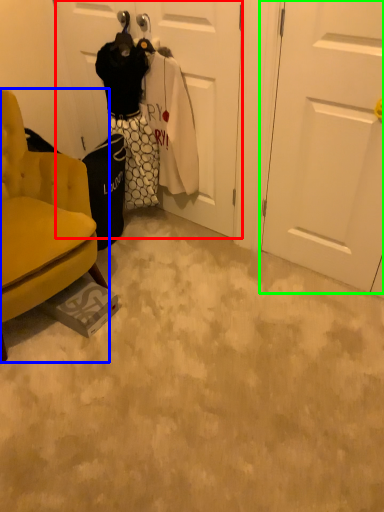
Question: Considering the real-world distances, which object is closest to door (highlighted by a red box)? chair (highlighted by a blue box) or door (highlighted by a green box).

Choices:
 (A) chair
 (B) door

Answer: (B)